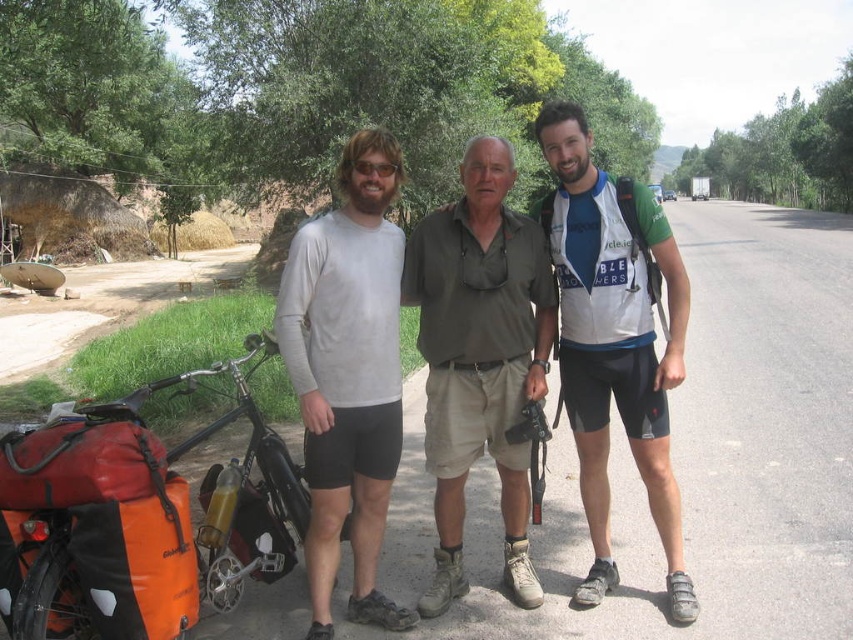
You are a photographer trying to capture a group photo of the khaki cotton shirt at center and the white mesh shirt at center. Which one should you focus on first if you want to ensure both are in focus, given their heights?

The khaki cotton shirt at center is shorter than the white mesh shirt at center, so focus on the khaki cotton shirt at center first to ensure both are in focus.

You are a photographer trying to capture a photo of the orange fabric motorcycle at lower left and the white mesh shirt at center. Which object should you focus on first if you want to ensure both are in focus without adjusting the camera settings?

The orange fabric motorcycle at lower left has a lesser height compared to the white mesh shirt at center, so you should focus on the taller object first, which is the white mesh shirt at center, to ensure both are in focus.